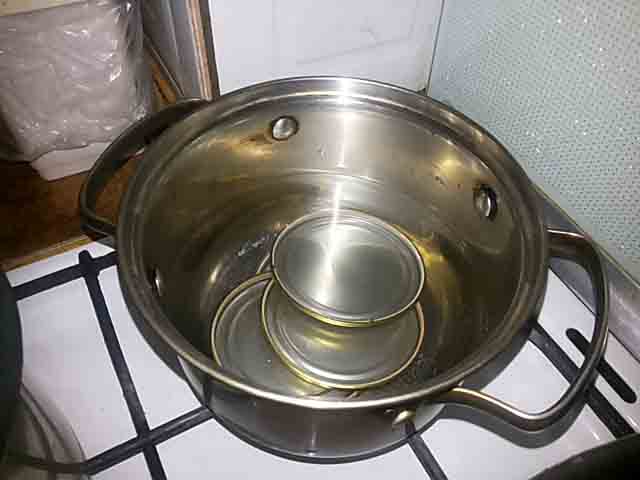
Find the location of a particular element. This screenshot has width=640, height=480. right handle is located at coordinates pyautogui.click(x=596, y=351).